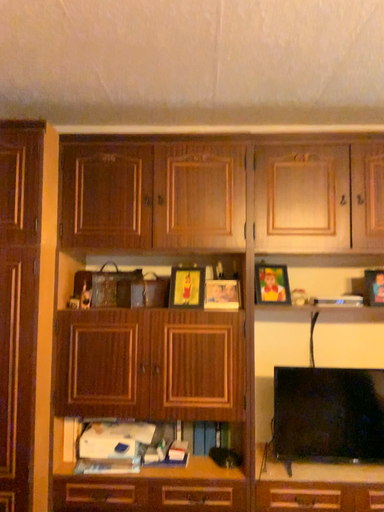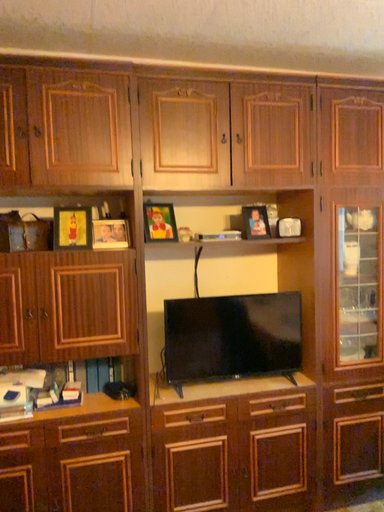
Question: Which way did the camera rotate in the video?

Choices:
 (A) rotated left
 (B) rotated right

Answer: (B)